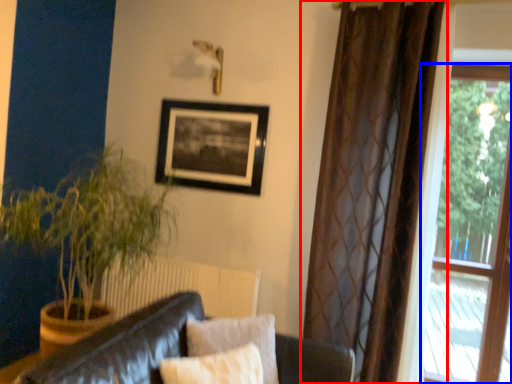
Question: Among these objects, which one is farthest to the camera, curtain (highlighted by a red box) or window (highlighted by a blue box)?

Choices:
 (A) curtain
 (B) window

Answer: (B)